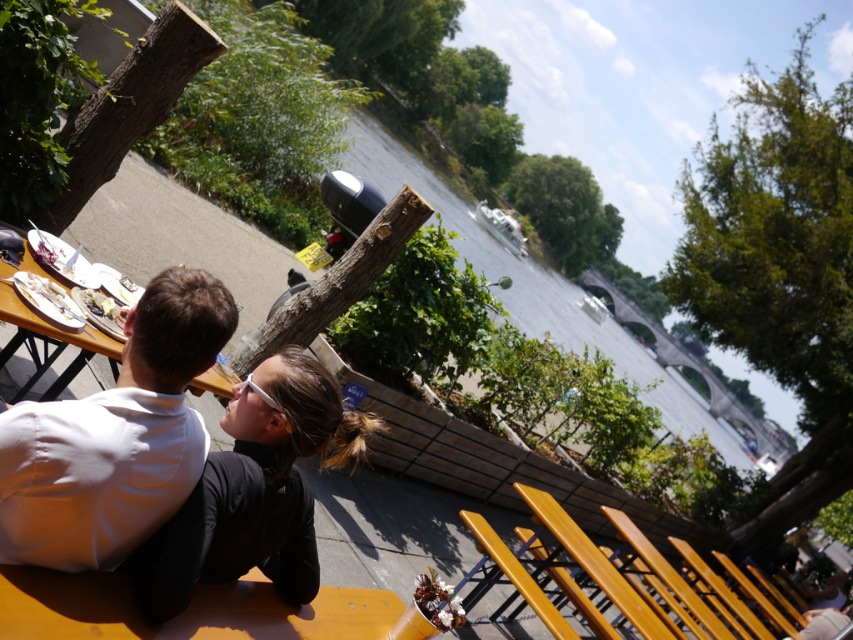
Question: Which object is the farthest from the white matte shirt at upper left?

Choices:
 (A) black matte jacket at center
 (B) wooden bench at lower center

Answer: (B)

Question: Can you confirm if white matte shirt at upper left is bigger than wooden picnic table at lower left?

Choices:
 (A) no
 (B) yes

Answer: (A)

Question: Which point is closer to the camera?

Choices:
 (A) wooden picnic table at lower left
 (B) black matte jacket at center
 (C) white matte shirt at upper left
 (D) wooden bench at lower center

Answer: (D)

Question: Is white matte shirt at upper left to the left of wooden bench at lower center from the viewer's perspective?

Choices:
 (A) yes
 (B) no

Answer: (A)

Question: Considering the real-world distances, which object is farthest from the black matte jacket at center?

Choices:
 (A) wooden bench at lower center
 (B) white matte shirt at upper left
 (C) wooden picnic table at lower left

Answer: (C)

Question: Does white matte shirt at upper left come in front of black matte jacket at center?

Choices:
 (A) no
 (B) yes

Answer: (B)